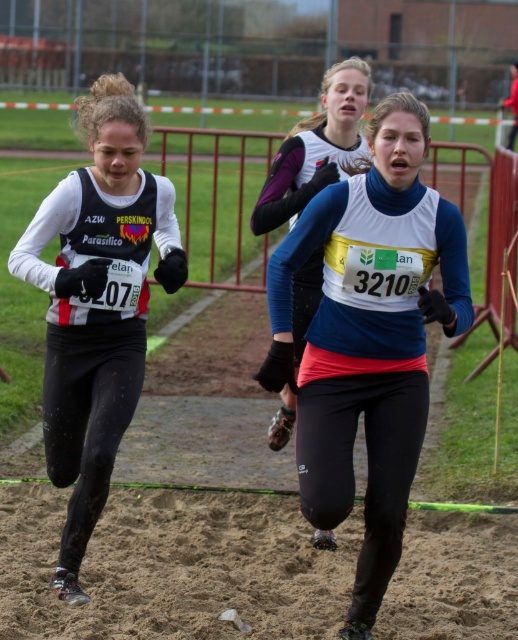
Question: Is blue fleece jacket at center positioned before matte black running suit at left?

Choices:
 (A) yes
 (B) no

Answer: (A)

Question: Which of the following is the closest to the observer?

Choices:
 (A) blue fleece jacket at center
 (B) matte black running suit at left

Answer: (A)

Question: Which object is closer to the camera taking this photo?

Choices:
 (A) matte black running suit at left
 (B) blue fleece jacket at center

Answer: (B)

Question: Can you confirm if blue fleece jacket at center is wider than matte black running suit at left?

Choices:
 (A) no
 (B) yes

Answer: (B)

Question: Is blue fleece jacket at center to the right of matte black running suit at left from the viewer's perspective?

Choices:
 (A) yes
 (B) no

Answer: (A)

Question: Which point is farther from the camera taking this photo?

Choices:
 (A) (116, 195)
 (B) (338, 323)

Answer: (A)